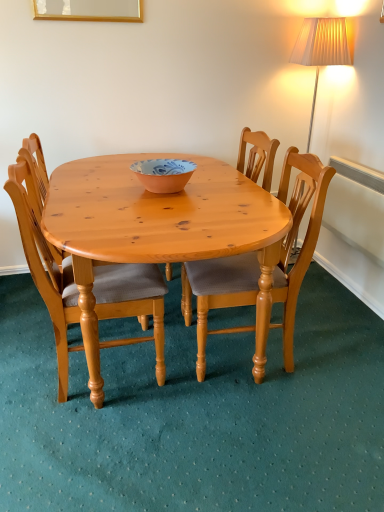
Where is `light brown wooden chair at center, the first chair when ordered from left to right`? Image resolution: width=384 pixels, height=512 pixels. light brown wooden chair at center, the first chair when ordered from left to right is located at coordinates (45, 267).

Measure the distance between wooden chair at center, positioned as the second chair in right-to-left order, and camera.

wooden chair at center, positioned as the second chair in right-to-left order, and camera are 6.53 feet apart from each other.

The width and height of the screenshot is (384, 512). What do you see at coordinates (164, 174) in the screenshot?
I see `blue and white ceramic bowl at center` at bounding box center [164, 174].

This screenshot has width=384, height=512. I want to click on light brown wood chair at center, acting as the 1th chair starting from the right, so click(x=296, y=234).

The image size is (384, 512). What are the coordinates of `light brown wooden chair at center, the third chair when ordered from right to left` in the screenshot? It's located at (45, 267).

Consider the image. Considering the relative positions of blue and white ceramic bowl at center and light brown wooden chair at center, the third chair when ordered from right to left, in the image provided, is blue and white ceramic bowl at center to the left of light brown wooden chair at center, the third chair when ordered from right to left, from the viewer's perspective?

Incorrect, blue and white ceramic bowl at center is not on the left side of light brown wooden chair at center, the third chair when ordered from right to left.

This screenshot has height=512, width=384. In order to click on bowl that is on the right side of light brown wooden chair at center, the first chair when ordered from left to right in this screenshot , I will do `click(164, 174)`.

Is blue and white ceramic bowl at center surrounding light brown wooden chair at center, the first chair when ordered from left to right?

That's incorrect, light brown wooden chair at center, the first chair when ordered from left to right, is not inside blue and white ceramic bowl at center.

From the picture: Can you confirm if blue and white ceramic bowl at center is shorter than light brown wooden chair at center, the first chair when ordered from left to right?

Yes.

Can we say wooden chair at center, arranged as the 2th chair when viewed from the left, lies outside light brown wooden chair at center, the third chair when ordered from right to left?

wooden chair at center, arranged as the 2th chair when viewed from the left, lies outside light brown wooden chair at center, the third chair when ordered from right to left,'s area.

From the image's perspective, which object appears higher, wooden chair at center, positioned as the second chair in right-to-left order, or light brown wooden chair at center, the first chair when ordered from left to right?

wooden chair at center, positioned as the second chair in right-to-left order, is shown above in the image.

This screenshot has width=384, height=512. I want to click on the 2nd chair above the light brown wooden chair at center, the third chair when ordered from right to left (from a real-world perspective), so click(x=258, y=155).

Between wooden chair at center, arranged as the 2th chair when viewed from the left, and light brown wooden chair at center, the first chair when ordered from left to right, which one has less height?

Standing shorter between the two is wooden chair at center, arranged as the 2th chair when viewed from the left.

In the scene shown: In terms of height, does wooden chair at center, positioned as the second chair in right-to-left order, look taller or shorter compared to light brown wood chair at center, acting as the 1th chair starting from the right?

wooden chair at center, positioned as the second chair in right-to-left order, is taller than light brown wood chair at center, acting as the 1th chair starting from the right.

Is point (266, 178) positioned in front of point (287, 368)?

That is False.

From the image's perspective, does wooden chair at center, positioned as the second chair in right-to-left order, appear lower than light brown wood chair at center, acting as the 1th chair starting from the right?

No, from the image's perspective, wooden chair at center, positioned as the second chair in right-to-left order, is not beneath light brown wood chair at center, acting as the 1th chair starting from the right.

From a real-world perspective, is wooden chair at center, positioned as the second chair in right-to-left order, physically located above or below light brown wood chair at center, the 3th chair in the left-to-right sequence?

From a real-world perspective, wooden chair at center, positioned as the second chair in right-to-left order, is physically above light brown wood chair at center, the 3th chair in the left-to-right sequence.

Considering the positions of objects light brown wooden chair at center, the first chair when ordered from left to right, and wooden chair at center, arranged as the 2th chair when viewed from the left, in the image provided, who is more to the left, light brown wooden chair at center, the first chair when ordered from left to right, or wooden chair at center, arranged as the 2th chair when viewed from the left,?

light brown wooden chair at center, the first chair when ordered from left to right.

From the image's perspective, which is above, light brown wooden chair at center, the first chair when ordered from left to right, or wooden chair at center, positioned as the second chair in right-to-left order?

wooden chair at center, positioned as the second chair in right-to-left order, from the image's perspective.

From a real-world perspective, is light brown wooden chair at center, the first chair when ordered from left to right, physically located above or below wooden chair at center, arranged as the 2th chair when viewed from the left?

→ From a real-world perspective, light brown wooden chair at center, the first chair when ordered from left to right, is physically below wooden chair at center, arranged as the 2th chair when viewed from the left.

Can you confirm if light brown wooden chair at center, the third chair when ordered from right to left, is smaller than wooden chair at center, arranged as the 2th chair when viewed from the left?

Yes.

How distant is wooden chair at center, positioned as the second chair in right-to-left order, from blue and white ceramic bowl at center?

wooden chair at center, positioned as the second chair in right-to-left order, and blue and white ceramic bowl at center are 19.85 inches apart.

Between wooden chair at center, arranged as the 2th chair when viewed from the left, and blue and white ceramic bowl at center, which one has smaller size?

blue and white ceramic bowl at center is smaller.

Is wooden chair at center, positioned as the second chair in right-to-left order, next to blue and white ceramic bowl at center and touching it?

They are not placed beside each other.

In the scene shown: Is wooden chair at center, positioned as the second chair in right-to-left order, facing away from blue and white ceramic bowl at center?

That's not correct — wooden chair at center, positioned as the second chair in right-to-left order, is not looking away from blue and white ceramic bowl at center.

Is light brown wooden chair at center, the first chair when ordered from left to right, not near blue and white ceramic bowl at center?

No, there isn't a large distance between light brown wooden chair at center, the first chair when ordered from left to right, and blue and white ceramic bowl at center.

Is point (66, 292) farther from viewer compared to point (150, 170)?

No, it is in front of (150, 170).

Considering the positions of objects light brown wooden chair at center, the third chair when ordered from right to left, and blue and white ceramic bowl at center in the image provided, who is more to the right, light brown wooden chair at center, the third chair when ordered from right to left, or blue and white ceramic bowl at center?

blue and white ceramic bowl at center.

Does light brown wooden chair at center, the first chair when ordered from left to right, turn towards blue and white ceramic bowl at center?

Yes, light brown wooden chair at center, the first chair when ordered from left to right, is turned towards blue and white ceramic bowl at center.

Does point (148, 164) come farther from viewer compared to point (266, 168)?

That is False.

Is blue and white ceramic bowl at center positioned with its back to wooden chair at center, positioned as the second chair in right-to-left order?

No, blue and white ceramic bowl at center is not facing away from wooden chair at center, positioned as the second chair in right-to-left order.

Identify the location of chair that is on the left side of blue and white ceramic bowl at center. The width and height of the screenshot is (384, 512). (45, 267).

Find the location of `the 2nd chair behind the light brown wooden chair at center, the third chair when ordered from right to left`. the 2nd chair behind the light brown wooden chair at center, the third chair when ordered from right to left is located at coordinates (258, 155).

When comparing their distances from light brown wooden chair at center, the third chair when ordered from right to left, does light brown wood chair at center, acting as the 1th chair starting from the right, or wooden chair at center, arranged as the 2th chair when viewed from the left, seem closer?

light brown wood chair at center, acting as the 1th chair starting from the right, lies closer to light brown wooden chair at center, the third chair when ordered from right to left, than the other object.

When comparing their distances from light brown wooden chair at center, the first chair when ordered from left to right, does light brown wood chair at center, the 3th chair in the left-to-right sequence, or blue and white ceramic bowl at center seem closer?

light brown wood chair at center, the 3th chair in the left-to-right sequence, is positioned closer to the anchor light brown wooden chair at center, the first chair when ordered from left to right.

When comparing their distances from blue and white ceramic bowl at center, does light brown wood chair at center, the 3th chair in the left-to-right sequence, or wooden chair at center, arranged as the 2th chair when viewed from the left, seem further?

wooden chair at center, arranged as the 2th chair when viewed from the left, is further to blue and white ceramic bowl at center.

Looking at this image, looking at the image, which one is located further to light brown wood chair at center, the 3th chair in the left-to-right sequence, wooden chair at center, positioned as the second chair in right-to-left order, or light brown wooden chair at center, the first chair when ordered from left to right?

The object further to light brown wood chair at center, the 3th chair in the left-to-right sequence, is wooden chair at center, positioned as the second chair in right-to-left order.

From the image, which object appears to be farther from light brown wood chair at center, acting as the 1th chair starting from the right, blue and white ceramic bowl at center or wooden chair at center, arranged as the 2th chair when viewed from the left?

wooden chair at center, arranged as the 2th chair when viewed from the left, lies further to light brown wood chair at center, acting as the 1th chair starting from the right, than the other object.

Which object lies further to the anchor point light brown wooden chair at center, the first chair when ordered from left to right, blue and white ceramic bowl at center or light brown wood chair at center, acting as the 1th chair starting from the right?

blue and white ceramic bowl at center.

Based on their spatial positions, is light brown wooden chair at center, the first chair when ordered from left to right, or wooden chair at center, arranged as the 2th chair when viewed from the left, closer to light brown wood chair at center, acting as the 1th chair starting from the right?

Among the two, light brown wooden chair at center, the first chair when ordered from left to right, is located nearer to light brown wood chair at center, acting as the 1th chair starting from the right.

Looking at this image, looking at the image, which one is located further to blue and white ceramic bowl at center, wooden chair at center, arranged as the 2th chair when viewed from the left, or light brown wooden chair at center, the third chair when ordered from right to left?

wooden chair at center, arranged as the 2th chair when viewed from the left, is positioned further to the anchor blue and white ceramic bowl at center.

Locate an element on the screen. chair located between light brown wooden chair at center, the first chair when ordered from left to right, and light brown wood chair at center, acting as the 1th chair starting from the right, in the left-right direction is located at coordinates (258, 155).

The width and height of the screenshot is (384, 512). I want to click on bowl between light brown wood chair at center, acting as the 1th chair starting from the right, and wooden chair at center, arranged as the 2th chair when viewed from the left, in the front-back direction, so click(164, 174).

Identify the location of bowl between light brown wooden chair at center, the first chair when ordered from left to right, and wooden chair at center, arranged as the 2th chair when viewed from the left, in the front-back direction. The image size is (384, 512). (164, 174).

The height and width of the screenshot is (512, 384). Identify the location of bowl between light brown wooden chair at center, the third chair when ordered from right to left, and light brown wood chair at center, the 3th chair in the left-to-right sequence, in the horizontal direction. (164, 174).